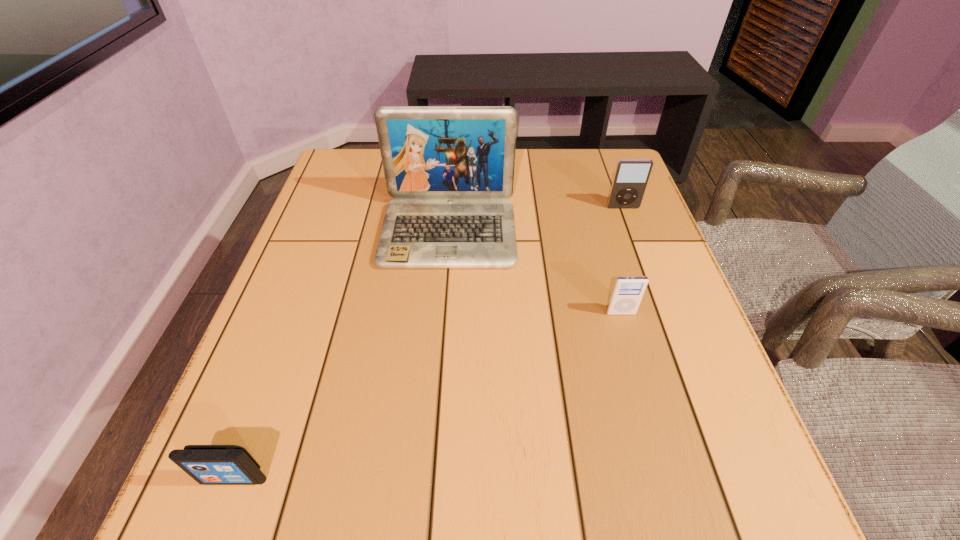
Where is `blank region between the third farthest object and the laptop computer`? blank region between the third farthest object and the laptop computer is located at coordinates coord(535,273).

At what (x,y) coordinates should I click in order to perform the action: click on unoccupied area between the second tallest object and the laptop computer. Please return your answer as a coordinate pair (x, y). Looking at the image, I should click on (536, 220).

Where is `empty location between the laptop computer and the second nearest object`? This screenshot has width=960, height=540. empty location between the laptop computer and the second nearest object is located at coordinates (535, 273).

You are a GUI agent. You are given a task and a screenshot of the screen. Output one action in this format:
    pyautogui.click(x=<x>, y=<y>)
    Task: Click on the vacant region between the tallest object and the rightmost object
    This screenshot has height=540, width=960.
    Given the screenshot: What is the action you would take?
    pyautogui.click(x=536, y=220)

At what (x,y) coordinates should I click in order to perform the action: click on empty space that is in between the leftmost iPod and the third farthest object. Please return your answer as a coordinate pair (x, y). Looking at the image, I should click on (427, 395).

This screenshot has height=540, width=960. In order to click on blank region between the second object from left to right and the second tallest object in this screenshot , I will do pos(536,220).

Locate an element on the screen. This screenshot has height=540, width=960. free space between the nearest iPod and the tallest iPod is located at coordinates (428, 343).

Where is `empty location between the laptop computer and the leftmost object`? empty location between the laptop computer and the leftmost object is located at coordinates (341, 355).

The width and height of the screenshot is (960, 540). What are the coordinates of `vacant region between the second object from right to left and the leftmost iPod` in the screenshot? It's located at (427, 395).

You are a GUI agent. You are given a task and a screenshot of the screen. Output one action in this format:
    pyautogui.click(x=<x>, y=<y>)
    Task: Click on the empty location between the second iPod from left to right and the farthest iPod
    The width and height of the screenshot is (960, 540).
    Given the screenshot: What is the action you would take?
    pyautogui.click(x=622, y=260)